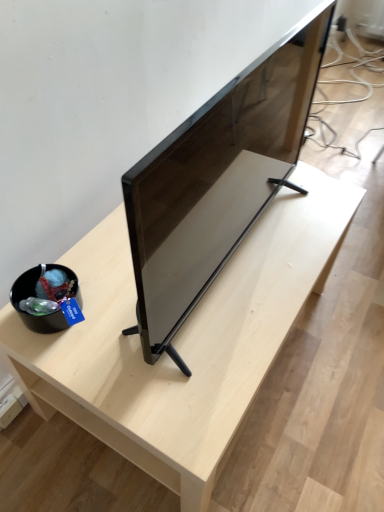
The width and height of the screenshot is (384, 512). Describe the element at coordinates (216, 182) in the screenshot. I see `matte black tv at center` at that location.

You are a GUI agent. You are given a task and a screenshot of the screen. Output one action in this format:
    pyautogui.click(x=<x>, y=<y>)
    Task: Click on the matte black tv at center
    The height and width of the screenshot is (512, 384).
    Given the screenshot: What is the action you would take?
    pyautogui.click(x=216, y=182)

In order to face light wood table at center, should I rotate leftwards or rightwards?

Turn right approximately 1.397 degrees to face it.

What is the approximate height of light wood table at center?

It is 45.52 centimeters.

Where is `light wood table at center`? This screenshot has width=384, height=512. light wood table at center is located at coordinates (182, 339).

Image resolution: width=384 pixels, height=512 pixels. Describe the element at coordinates (182, 339) in the screenshot. I see `light wood table at center` at that location.

This screenshot has width=384, height=512. In order to click on matte black tv at center in this screenshot , I will do `click(216, 182)`.

Between matte black tv at center and light wood table at center, which one appears on the left side from the viewer's perspective?

light wood table at center.

Based on the photo, considering their positions, is matte black tv at center located in front of or behind light wood table at center?

matte black tv at center is in front of light wood table at center.

Which point is more forward, (203, 234) or (231, 343)?

The point (203, 234) is in front.

From the image's perspective, between matte black tv at center and light wood table at center, who is located below?

light wood table at center appears lower in the image.

Based on the photo, from a real-world perspective, which object rests below the other?

In real-world perspective, light wood table at center is lower.

Looking at their sizes, would you say matte black tv at center is wider or thinner than light wood table at center?

matte black tv at center is thinner than light wood table at center.

From their relative heights in the image, would you say matte black tv at center is taller or shorter than light wood table at center?

Considering their sizes, matte black tv at center has more height than light wood table at center.

Considering the sizes of matte black tv at center and light wood table at center in the image, is matte black tv at center bigger or smaller than light wood table at center?

Considering their sizes, matte black tv at center takes up less space than light wood table at center.

Is matte black tv at center inside or outside of light wood table at center?

matte black tv at center is not enclosed by light wood table at center.

Is matte black tv at center not close to light wood table at center?

No, matte black tv at center is not far from light wood table at center.

Could you tell me if matte black tv at center is facing light wood table at center?

No, matte black tv at center does not turn towards light wood table at center.

Can you tell me how much matte black tv at center and light wood table at center differ in facing direction?

The facing directions of matte black tv at center and light wood table at center are 1.27 degrees apart.

The width and height of the screenshot is (384, 512). I want to click on television above the light wood table at center (from a real-world perspective), so click(x=216, y=182).

In the scene shown: Can you confirm if light wood table at center is positioned to the left of matte black tv at center?

Correct, you'll find light wood table at center to the left of matte black tv at center.

Considering the positions of objects light wood table at center and matte black tv at center in the image provided, who is in front, light wood table at center or matte black tv at center?

Positioned in front is matte black tv at center.

Which is behind, point (70, 411) or point (156, 277)?

The point (70, 411) is farther from the camera.

From the image's perspective, is light wood table at center beneath matte black tv at center?

Yes, from the image's perspective, light wood table at center is below matte black tv at center.

From a real-world perspective, between light wood table at center and matte black tv at center, who is vertically lower?

light wood table at center is physically lower.

Which object is thinner, light wood table at center or matte black tv at center?

Thinner between the two is matte black tv at center.

Is light wood table at center taller or shorter than matte black tv at center?

In the image, light wood table at center appears to be shorter than matte black tv at center.

Looking at the image, does light wood table at center seem bigger or smaller compared to matte black tv at center?

light wood table at center is bigger than matte black tv at center.

Is light wood table at center completely or partially outside of matte black tv at center?

That's correct, light wood table at center is outside of matte black tv at center.

Is the surface of light wood table at center in direct contact with matte black tv at center?

light wood table at center is not next to matte black tv at center, and they're not touching.

Is light wood table at center facing away from matte black tv at center?

No, matte black tv at center is not at the back of light wood table at center.

How many degrees apart are the facing directions of light wood table at center and matte black tv at center?

They differ by 1.27 degrees in their facing directions.

How much distance is there between light wood table at center and matte black tv at center?

light wood table at center and matte black tv at center are 7.50 inches apart from each other.

At what (x,y) coordinates should I click in order to perform the action: click on table on the left side of matte black tv at center. Please return your answer as a coordinate pair (x, y). This screenshot has width=384, height=512. Looking at the image, I should click on (182, 339).

This screenshot has width=384, height=512. In order to click on table below the matte black tv at center (from the image's perspective) in this screenshot , I will do `click(182, 339)`.

Image resolution: width=384 pixels, height=512 pixels. I want to click on table on the left side of matte black tv at center, so click(182, 339).